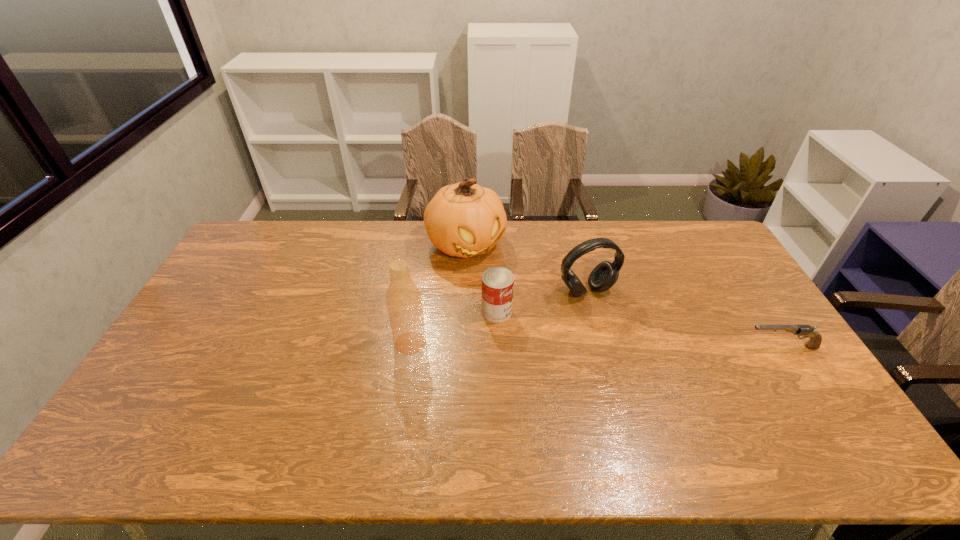
Image resolution: width=960 pixels, height=540 pixels. I want to click on free space between the rightmost object and the beer bottle, so click(x=596, y=345).

Where is `vacant area between the second shortest object and the rightmost object`? This screenshot has height=540, width=960. vacant area between the second shortest object and the rightmost object is located at coordinates (639, 329).

I want to click on vacant space that is in between the second shortest object and the rightmost object, so click(639, 329).

Where is `unoccupied position between the can and the headset`? unoccupied position between the can and the headset is located at coordinates (541, 301).

Locate an element on the screen. Image resolution: width=960 pixels, height=540 pixels. vacant area between the beer bottle and the can is located at coordinates (453, 327).

Identify the location of free space between the pumpkin and the fourth object from left to right. (526, 268).

I want to click on free area in between the can and the beer bottle, so click(x=453, y=327).

Locate an element on the screen. This screenshot has width=960, height=540. vacant region between the beer bottle and the farthest object is located at coordinates (438, 294).

Image resolution: width=960 pixels, height=540 pixels. Find the location of `vacant area between the can and the third tallest object`. vacant area between the can and the third tallest object is located at coordinates (541, 301).

Identify which object is the second nearest to the shortest object. Please provide its 2D coordinates. Your answer should be formatted as a tuple, i.e. [(x, y)], where the tuple contains the x and y coordinates of a point satisfying the conditions above.

[(497, 282)]